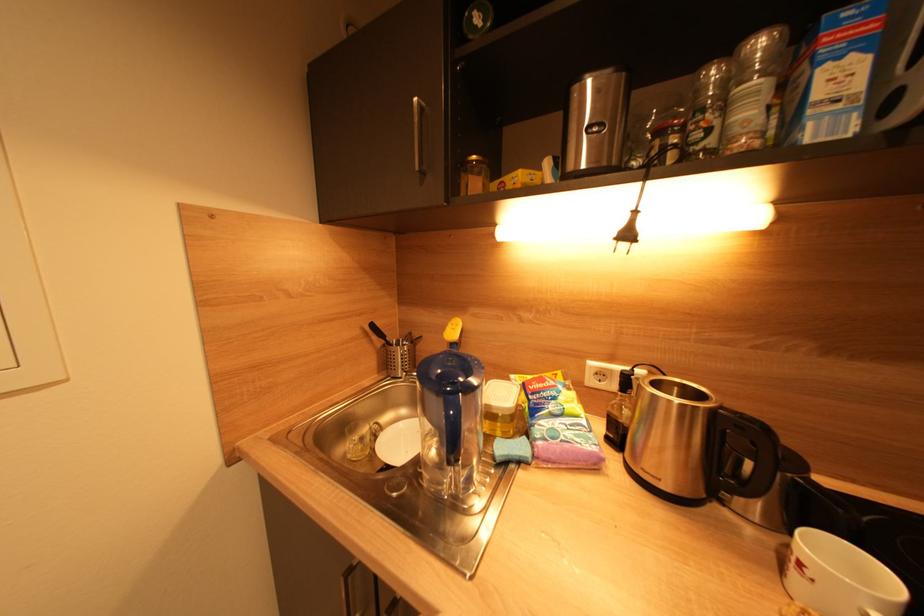
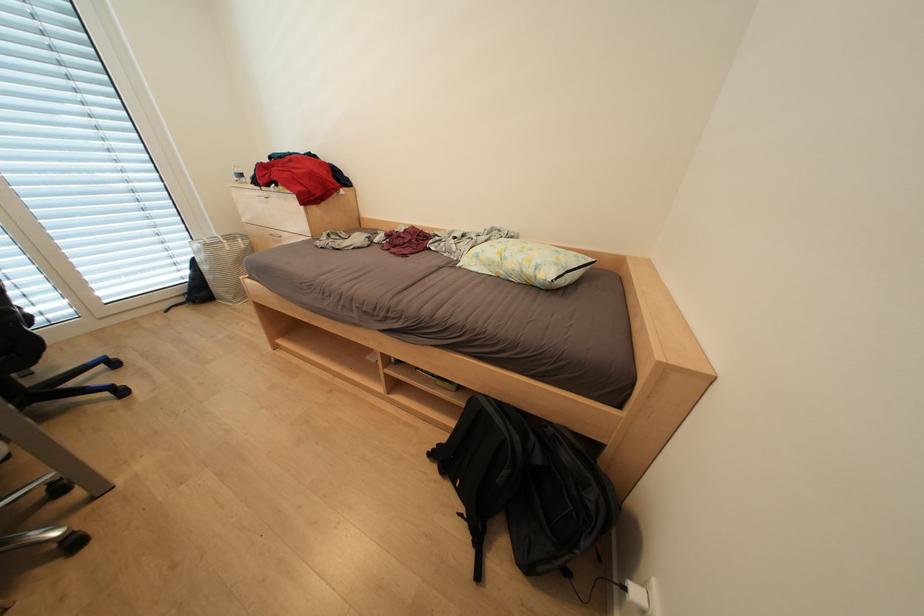
Question: The images are taken continuously from a first-person perspective. In which direction are you moving?

Choices:
 (A) Left
 (B) Right
 (C) Forward
 (D) Backward

Answer: (A)